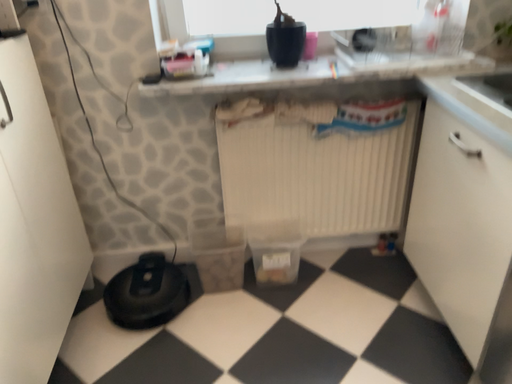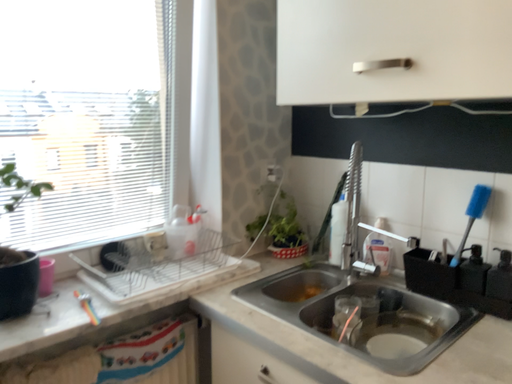
Question: Which way did the camera rotate in the video?

Choices:
 (A) rotated downward
 (B) rotated upward

Answer: (B)